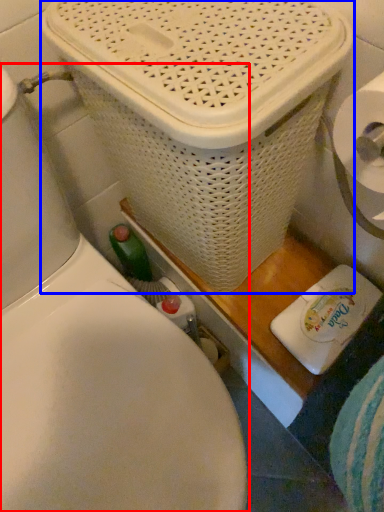
Question: Which of the following is the farthest to the observer, toilet (highlighted by a red box) or basket container (highlighted by a blue box)?

Choices:
 (A) toilet
 (B) basket container

Answer: (B)